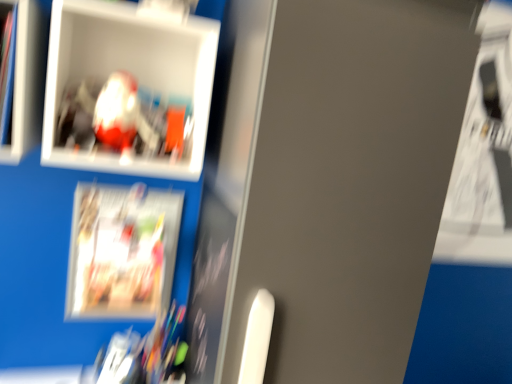
Question: From a real-world perspective, is matte plastic picture frame at upper left located beneath white plastic cabinet at upper left?

Choices:
 (A) no
 (B) yes

Answer: (A)

Question: Considering the relative positions of matte plastic picture frame at upper left and white plastic cabinet at upper left in the image provided, is matte plastic picture frame at upper left to the left of white plastic cabinet at upper left from the viewer's perspective?

Choices:
 (A) yes
 (B) no

Answer: (B)

Question: Can you confirm if matte plastic picture frame at upper left is wider than white plastic cabinet at upper left?

Choices:
 (A) no
 (B) yes

Answer: (B)

Question: Is matte plastic picture frame at upper left turned away from white plastic cabinet at upper left?

Choices:
 (A) no
 (B) yes

Answer: (A)

Question: Could you tell me if matte plastic picture frame at upper left is facing white plastic cabinet at upper left?

Choices:
 (A) yes
 (B) no

Answer: (B)

Question: From the image's perspective, relative to matte paper magazine at lower left, is white plastic cabinet at upper left above or below?

Choices:
 (A) below
 (B) above

Answer: (B)

Question: From a real-world perspective, relative to matte paper magazine at lower left, is white plastic cabinet at upper left vertically above or below?

Choices:
 (A) above
 (B) below

Answer: (A)

Question: In the image, is white plastic cabinet at upper left positioned in front of or behind matte paper magazine at lower left?

Choices:
 (A) front
 (B) behind

Answer: (A)

Question: Considering the positions of white plastic cabinet at upper left and matte paper magazine at lower left in the image, is white plastic cabinet at upper left taller or shorter than matte paper magazine at lower left?

Choices:
 (A) short
 (B) tall

Answer: (A)

Question: From a real-world perspective, is matte plastic picture frame at upper left above or below white plastic cabinet at upper left?

Choices:
 (A) below
 (B) above

Answer: (B)

Question: In the image, is matte plastic picture frame at upper left on the left side or the right side of white plastic cabinet at upper left?

Choices:
 (A) left
 (B) right

Answer: (B)

Question: From the image's perspective, relative to white plastic cabinet at upper left, is matte plastic picture frame at upper left above or below?

Choices:
 (A) below
 (B) above

Answer: (A)

Question: From their relative heights in the image, would you say matte plastic picture frame at upper left is taller or shorter than white plastic cabinet at upper left?

Choices:
 (A) short
 (B) tall

Answer: (B)

Question: From the image's perspective, is matte paper magazine at lower left positioned above or below white plastic cabinet at upper left?

Choices:
 (A) below
 (B) above

Answer: (A)

Question: In terms of size, does matte paper magazine at lower left appear bigger or smaller than white plastic cabinet at upper left?

Choices:
 (A) big
 (B) small

Answer: (B)